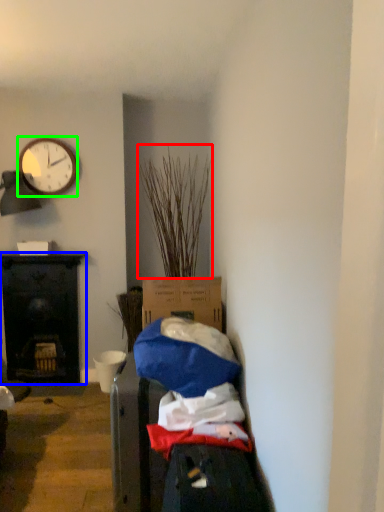
Question: Which is farther away from plant (highlighted by a red box)? desk (highlighted by a blue box) or clock (highlighted by a green box)?

Choices:
 (A) desk
 (B) clock

Answer: (A)